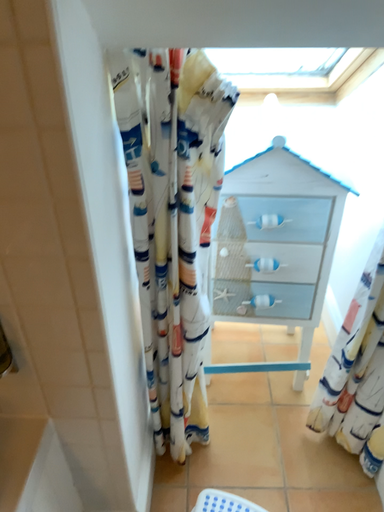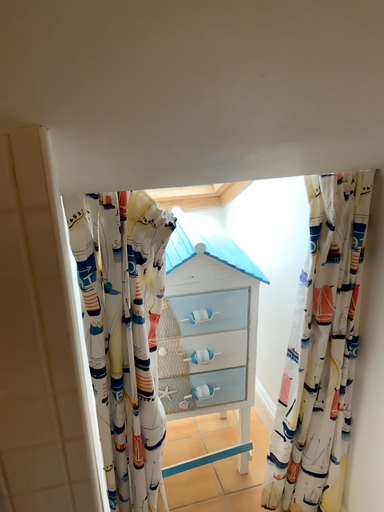
Question: How did the camera likely rotate when shooting the video?

Choices:
 (A) rotated left
 (B) rotated right

Answer: (B)